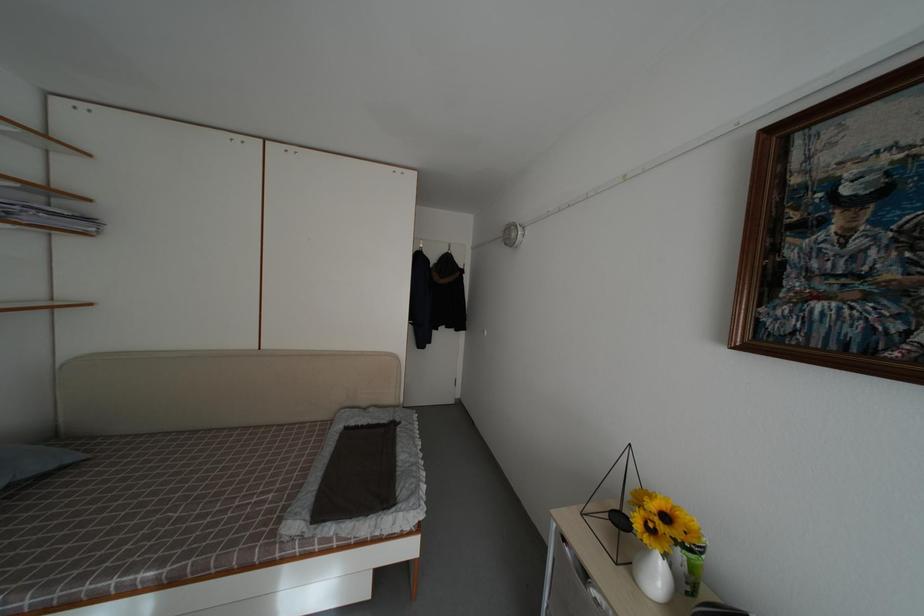
What are the coordinates of `blue pillow` in the screenshot? It's located at (32, 461).